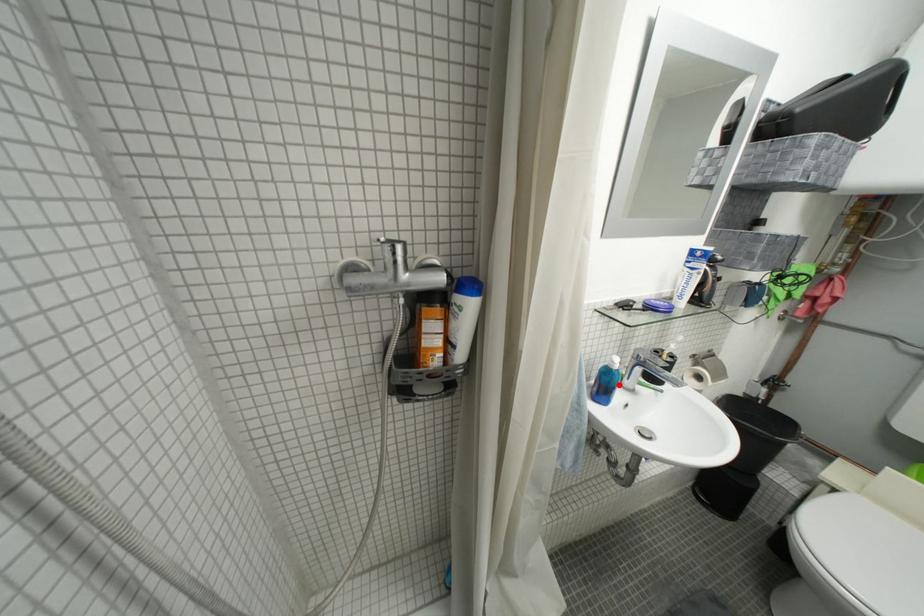
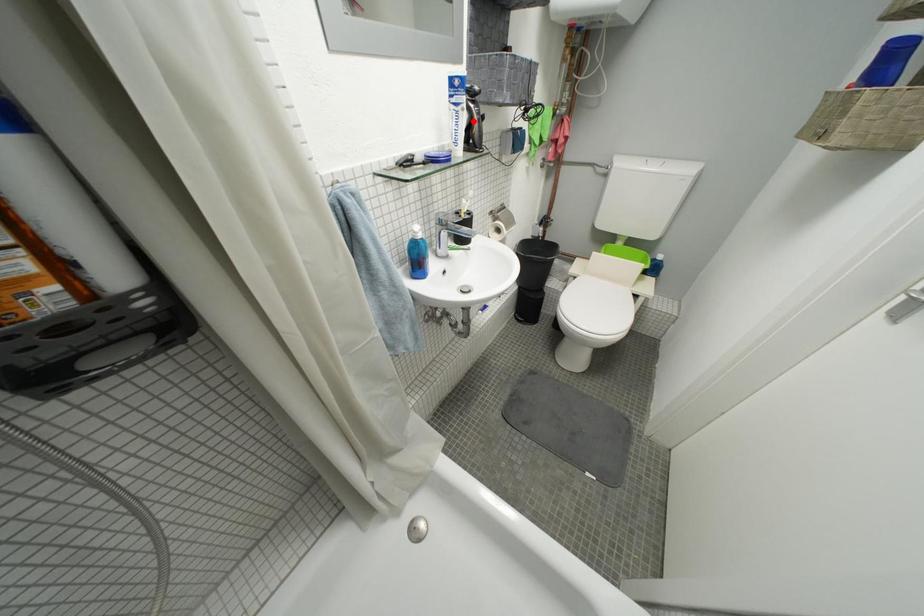
I am providing you with two images of the same scene from different viewpoints. A red point is marked on the first image and another point is marked on the second image. Is the red point in image1 aligned with the point shown in image2?

No